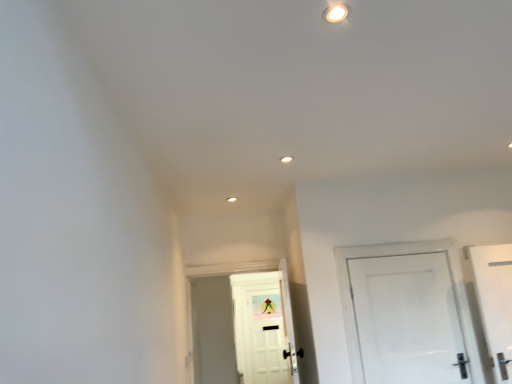
Question: In which direction should I rotate to look at white matte door at center, which is the 2th door from front to back?

Choices:
 (A) right
 (B) left

Answer: (B)

Question: Can white matte door at center, which is counted as the 1th door, starting from the back, be found inside white glossy door at right, the second door viewed from the left?

Choices:
 (A) no
 (B) yes

Answer: (A)

Question: Is white glossy door at right, which is the 1th door from front to back, further to camera compared to white matte door at center, the 2th door in the right-to-left sequence?

Choices:
 (A) no
 (B) yes

Answer: (A)

Question: Does white glossy door at right, the first door viewed from the right, appear on the right side of white matte door at center, which is counted as the 1th door, starting from the back?

Choices:
 (A) no
 (B) yes

Answer: (B)

Question: Is white glossy door at right, the first door viewed from the right, located outside white matte door at center, which is counted as the first door, starting from the left?

Choices:
 (A) no
 (B) yes

Answer: (B)

Question: Is white glossy door at right, the second door viewed from the left, placed right next to white matte door at center, which is counted as the 1th door, starting from the back?

Choices:
 (A) yes
 (B) no

Answer: (B)

Question: Can you confirm if white glossy door at right, which is the 1th door from front to back, is taller than white matte door at center, which is counted as the 1th door, starting from the back?

Choices:
 (A) yes
 (B) no

Answer: (B)

Question: Considering the relative positions of white matte door at center, which is counted as the first door, starting from the left, and white glossy door at right, the second door viewed from the left, in the image provided, is white matte door at center, which is counted as the first door, starting from the left, to the left of white glossy door at right, the second door viewed from the left, from the viewer's perspective?

Choices:
 (A) no
 (B) yes

Answer: (B)

Question: Is white glossy door at right, the second door viewed from the left, at the back of white matte door at center, which is the 2th door from front to back?

Choices:
 (A) no
 (B) yes

Answer: (A)

Question: Is white matte door at center, which is counted as the 1th door, starting from the back, positioned behind white glossy door at right, the first door viewed from the right?

Choices:
 (A) yes
 (B) no

Answer: (A)

Question: Can you confirm if white matte door at center, which is counted as the 1th door, starting from the back, is smaller than white glossy door at right, the first door viewed from the right?

Choices:
 (A) no
 (B) yes

Answer: (A)

Question: Are white matte door at center, which is counted as the 1th door, starting from the back, and white glossy door at right, placed as the 2th door when sorted from back to front, beside each other?

Choices:
 (A) yes
 (B) no

Answer: (B)

Question: From a real-world perspective, is white matte door at center, which is counted as the first door, starting from the left, over white glossy door at right, the second door viewed from the left?

Choices:
 (A) no
 (B) yes

Answer: (B)

Question: Is white glossy door at right, the second door viewed from the left, bigger or smaller than white matte door at center, the 2th door in the right-to-left sequence?

Choices:
 (A) small
 (B) big

Answer: (A)